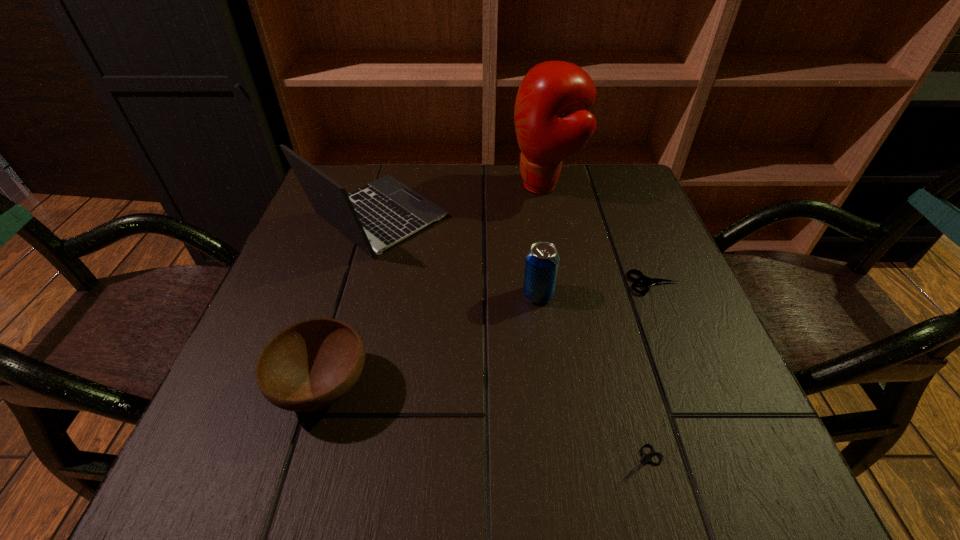
This screenshot has height=540, width=960. In order to click on vacant space at the left edge of the desktop in this screenshot , I will do `click(290, 303)`.

Image resolution: width=960 pixels, height=540 pixels. In the image, there is a desktop. Identify the location of vacant space at the right edge. (616, 241).

In the image, there is a desktop. Find the location of `vacant region at the near left corner`. vacant region at the near left corner is located at coordinates (279, 496).

Where is `vacant region at the far right corner`? This screenshot has width=960, height=540. vacant region at the far right corner is located at coordinates (618, 185).

The width and height of the screenshot is (960, 540). In order to click on free spot between the tallest object and the laptop_computer in this screenshot , I will do `click(461, 201)`.

Find the location of a particular element. The width and height of the screenshot is (960, 540). free space between the right shears and the beer can is located at coordinates (596, 289).

Where is `empty space between the fourth shortest object and the right shears`? This screenshot has width=960, height=540. empty space between the fourth shortest object and the right shears is located at coordinates (596, 289).

Locate an element on the screen. This screenshot has width=960, height=540. vacant point located between the farther shears and the shorter shears is located at coordinates (646, 374).

Locate an element on the screen. free space between the farther shears and the boxing glove is located at coordinates (600, 234).

The image size is (960, 540). Identify the location of unoccupied area between the nearest object and the rightmost object. (646, 374).